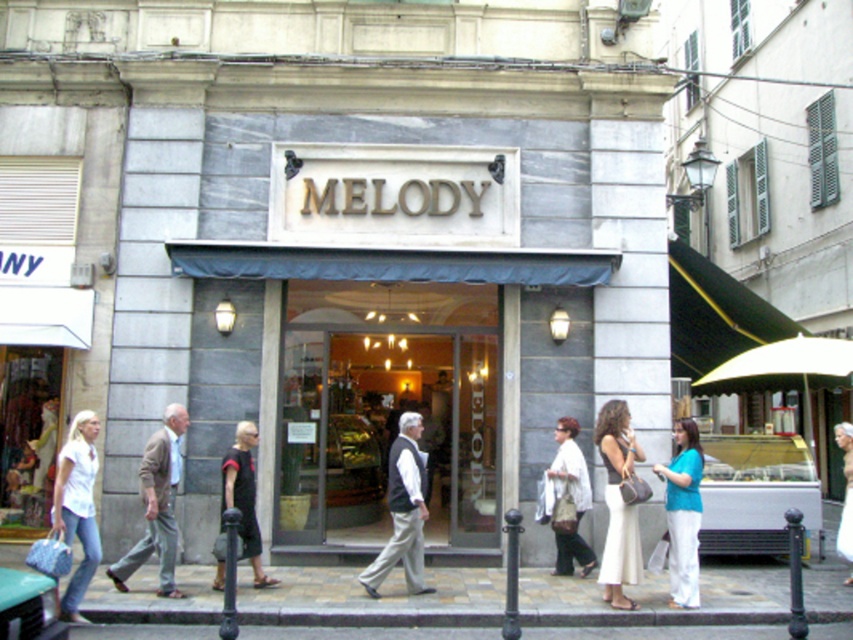
Does point (630, 552) come closer to viewer compared to point (160, 442)?

Yes, it is in front of point (160, 442).

The height and width of the screenshot is (640, 853). What do you see at coordinates (618, 502) in the screenshot?
I see `white cotton pants at center` at bounding box center [618, 502].

Locate an element on the screen. white cotton pants at center is located at coordinates (618, 502).

Is black fabric shirt at center closer to camera compared to white cotton blouse at center?

Yes, it is in front of white cotton blouse at center.

Is black fabric shirt at center wider than white cotton blouse at center?

Correct, the width of black fabric shirt at center exceeds that of white cotton blouse at center.

This screenshot has height=640, width=853. What do you see at coordinates (244, 497) in the screenshot?
I see `black fabric shirt at center` at bounding box center [244, 497].

The image size is (853, 640). I want to click on black fabric shirt at center, so click(x=244, y=497).

Who is lower down, gray wool vest at center or white cotton blouse at center?

white cotton blouse at center is below.

Does gray wool vest at center have a smaller size compared to white cotton blouse at center?

No, gray wool vest at center is not smaller than white cotton blouse at center.

Who is more forward, [398,516] or [581,486]?

Point [398,516]

Image resolution: width=853 pixels, height=640 pixels. In order to click on gray wool vest at center in this screenshot , I will do `click(403, 509)`.